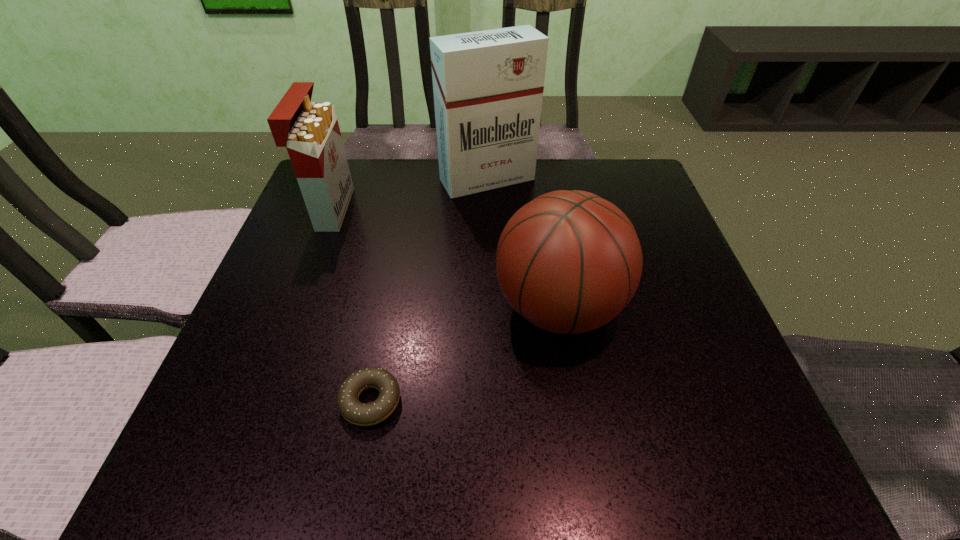
Locate an element on the screen. The image size is (960, 540). the taller cigarette case is located at coordinates (488, 85).

Locate an element on the screen. The image size is (960, 540). the right cigarette case is located at coordinates pos(488,85).

The image size is (960, 540). Find the location of `the leftmost object`. the leftmost object is located at coordinates (310, 131).

Where is `the shorter cigarette case`? The width and height of the screenshot is (960, 540). the shorter cigarette case is located at coordinates (x=310, y=131).

Locate an element on the screen. basketball is located at coordinates (568, 261).

Identify the location of the second object from left to right. (355, 412).

Image resolution: width=960 pixels, height=540 pixels. I want to click on the nearest object, so click(x=355, y=412).

Locate an element on the screen. This screenshot has width=960, height=540. vacant area located on the left of the tallest object is located at coordinates (332, 179).

Where is `free spot located 0.150m with the lid open on the leftmost object`? The height and width of the screenshot is (540, 960). free spot located 0.150m with the lid open on the leftmost object is located at coordinates (409, 209).

Locate an element on the screen. blank area located on the left of the basketball is located at coordinates (453, 308).